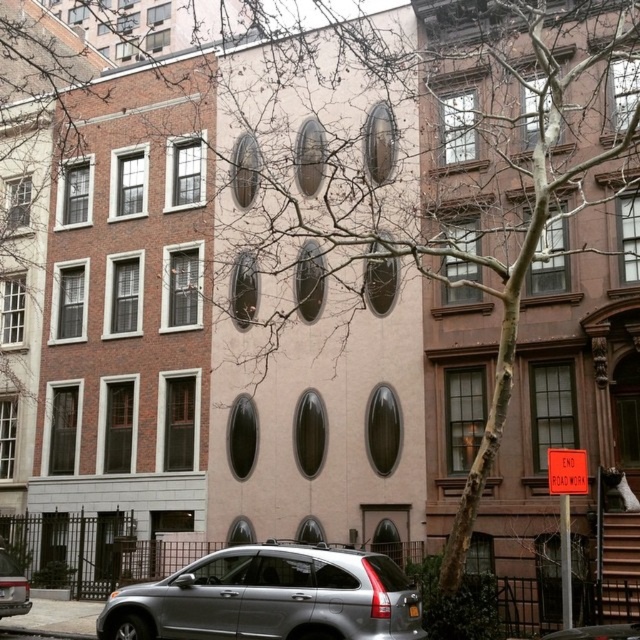
Is satin silver suv at lower center positioned behind silver metallic suv at lower left?

No, satin silver suv at lower center is in front of silver metallic suv at lower left.

Does satin silver suv at lower center have a larger size compared to silver metallic suv at lower left?

Yes.

Where is `satin silver suv at lower center`? The height and width of the screenshot is (640, 640). satin silver suv at lower center is located at coordinates (269, 596).